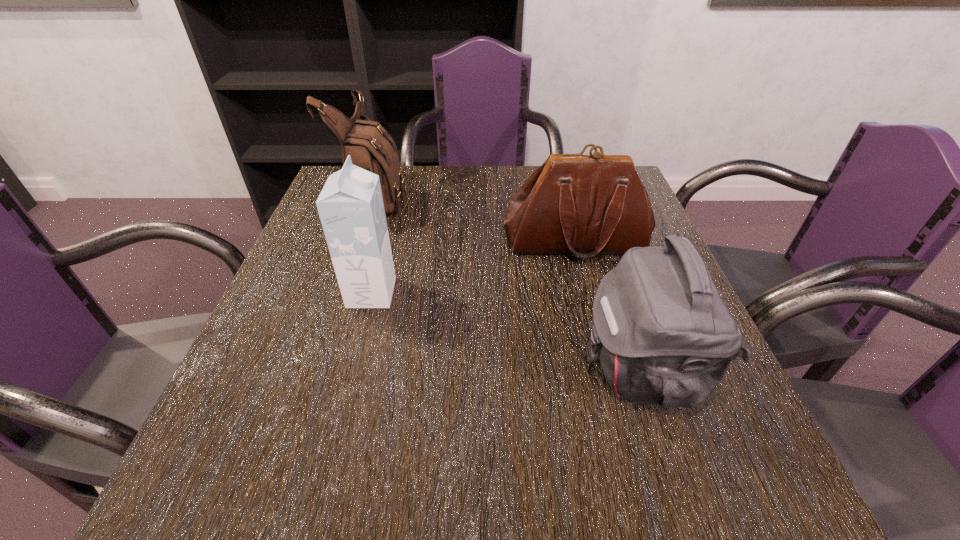
Locate an element on the screen. This screenshot has width=960, height=540. carton that is at the left edge is located at coordinates (350, 206).

At what (x,y) coordinates should I click in order to perform the action: click on object that is at the far left corner. Please return your answer as a coordinate pair (x, y). Looking at the image, I should click on [x=370, y=146].

In the image, there is a desktop. Where is `vacant area at the far edge`? This screenshot has height=540, width=960. vacant area at the far edge is located at coordinates (462, 170).

Image resolution: width=960 pixels, height=540 pixels. In order to click on blank space at the near edge in this screenshot , I will do `click(438, 482)`.

At what (x,y) coordinates should I click in order to perform the action: click on free space at the left edge. Please return your answer as a coordinate pair (x, y). The height and width of the screenshot is (540, 960). Looking at the image, I should click on (324, 265).

In the image, there is a desktop. At what (x,y) coordinates should I click in order to perform the action: click on vacant area at the near left corner. Please return your answer as a coordinate pair (x, y). This screenshot has width=960, height=540. Looking at the image, I should click on (278, 469).

In order to click on vacant space at the near right corner in this screenshot , I will do `click(750, 490)`.

Identify the location of vacant space in between the carton and the nearest object. This screenshot has height=540, width=960. click(x=506, y=330).

Locate an element on the screen. free area in between the nearest object and the leftmost shoulder bag is located at coordinates (509, 282).

At what (x,y) coordinates should I click in order to perform the action: click on empty location between the third farthest object and the nearest object. Please return your answer as a coordinate pair (x, y). This screenshot has width=960, height=540. Looking at the image, I should click on (506, 330).